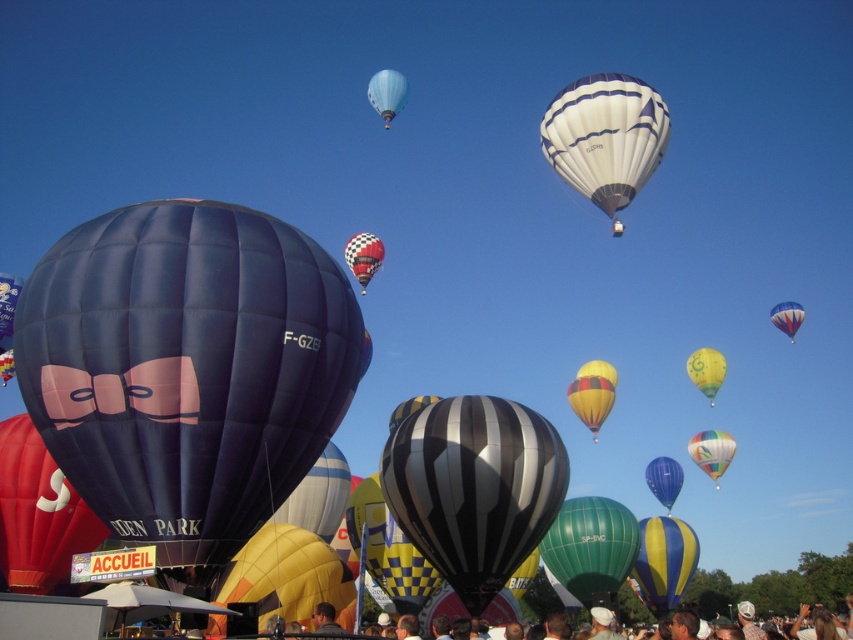
Question: Which point is farther from the camera taking this photo?

Choices:
 (A) (259, 218)
 (B) (720, 371)
 (C) (602, 196)

Answer: (B)

Question: Which is nearer to the checkered fabric hot air balloon at center?

Choices:
 (A) blue striped hot air balloon at upper right
 (B) yellowmaterial/textureballoon at upper right

Answer: (B)

Question: Is light blue fabric balloon at upper center thinner than checkered fabric hot air balloon at center?

Choices:
 (A) yes
 (B) no

Answer: (B)

Question: Is white striped balloon at upper center to the right of yellowmaterial/textureballoon at upper right from the viewer's perspective?

Choices:
 (A) yes
 (B) no

Answer: (B)

Question: Considering the real-world distances, which object is closest to the light blue fabric balloon at upper center?

Choices:
 (A) blue striped hot air balloon at upper right
 (B) dark blue fabric balloon at center

Answer: (A)

Question: Is light blue fabric balloon at upper center wider than blue glossy balloon at center?

Choices:
 (A) no
 (B) yes

Answer: (B)